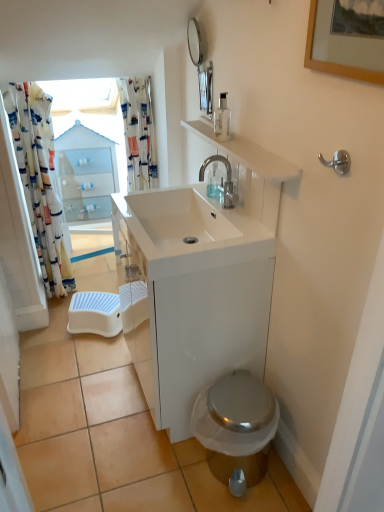
Question: From the image's perspective, is transparent glass soap dispenser at upper center located above or below wooden picture frame at upper right?

Choices:
 (A) above
 (B) below

Answer: (B)

Question: Visually, is transparent glass soap dispenser at upper center positioned to the left or to the right of wooden picture frame at upper right?

Choices:
 (A) right
 (B) left

Answer: (B)

Question: Which object is the closest to the wooden picture frame at upper right?

Choices:
 (A) shiny metallic toilet at lower right
 (B) transparent glass soap dispenser at upper center
 (C) white printed fabric shower curtain at left, placed as the first shower curtain when sorted from left to right
 (D) metallic silver trash can at lower right
 (E) silver metallic hook at upper right

Answer: (E)

Question: Which is farther from the silver metallic mirror at upper center?

Choices:
 (A) white plastic step stool at lower left
 (B) white glossy cabinet at upper center
 (C) silver metallic hook at upper right
 (D) wooden picture frame at upper right
 (E) satin nickel faucet at center

Answer: (A)